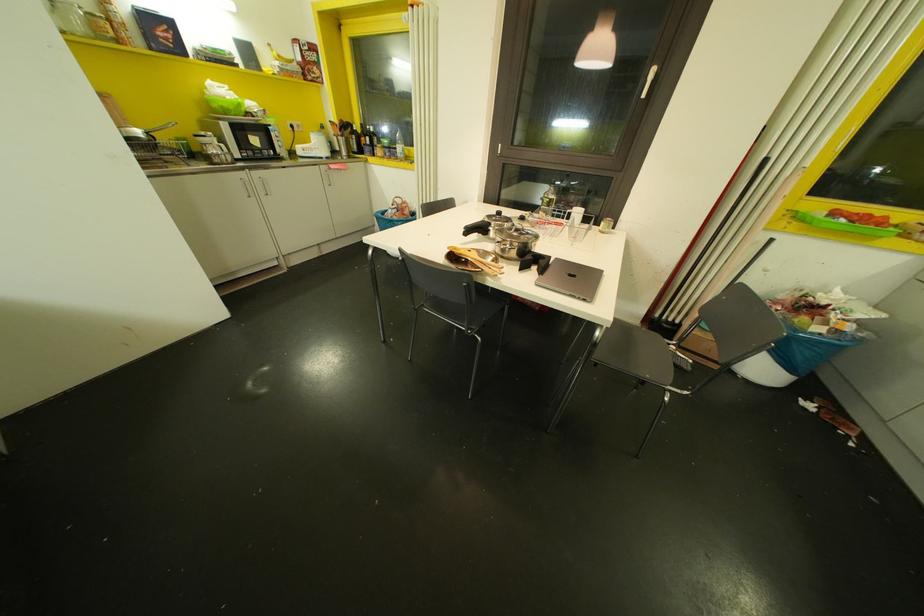
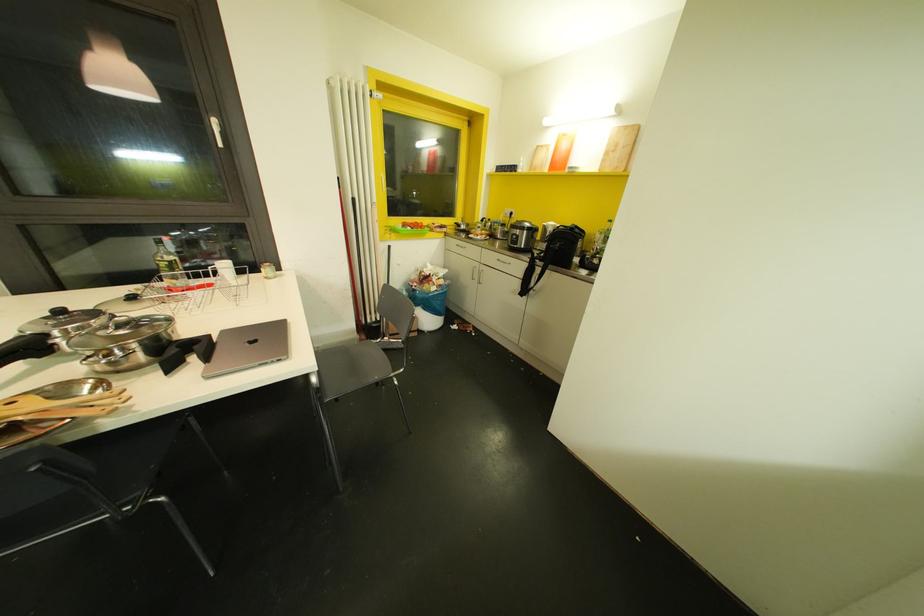
Locate, in the second image, the point that corresponds to (x=641, y=95) in the first image.

(220, 145)